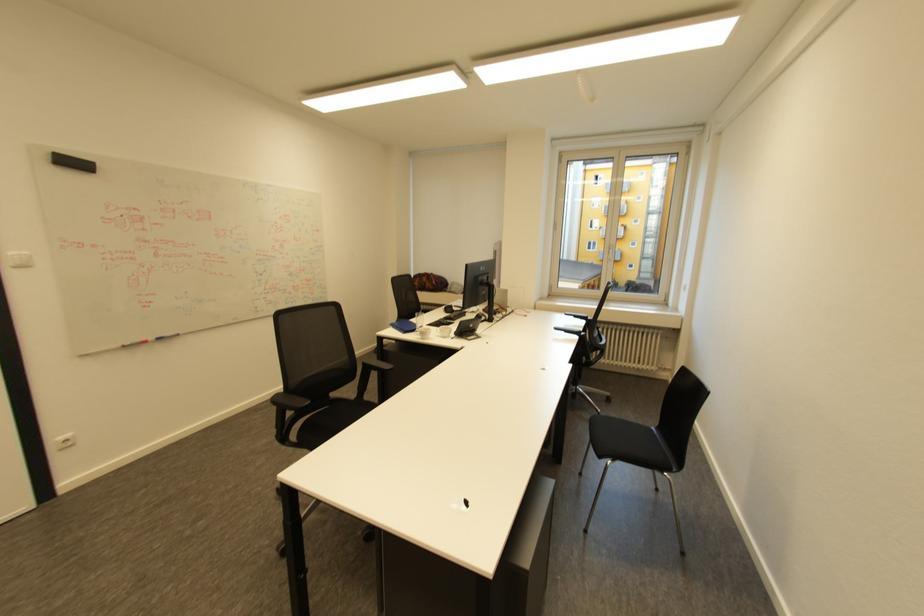
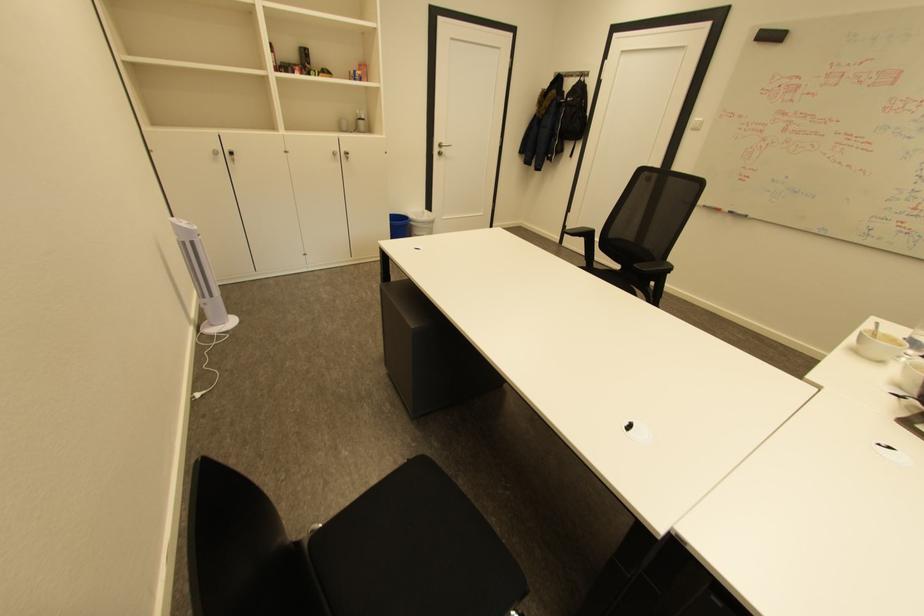
Where in the second image is the point corresponding to pixel 58 153 from the first image?

(768, 30)